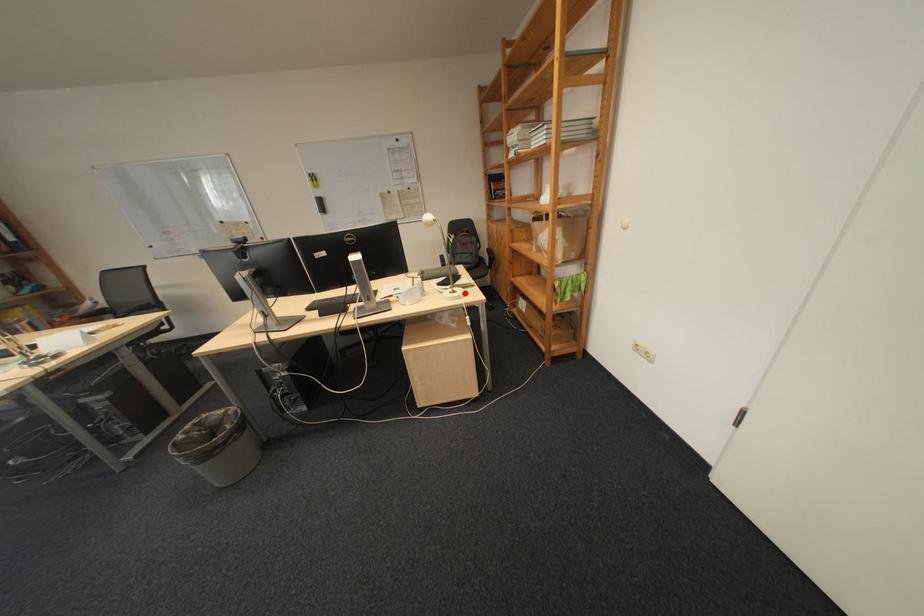
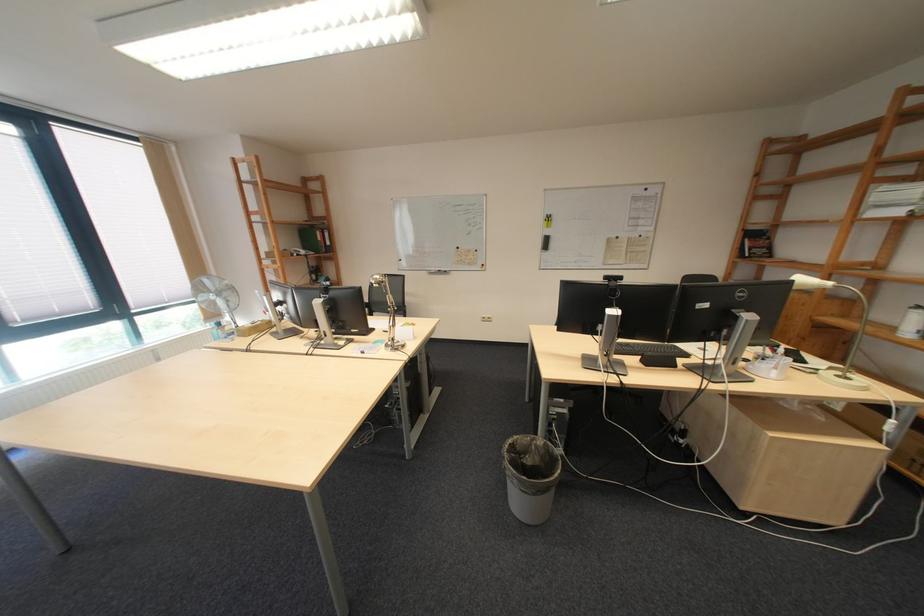
Where in the second image is the point corresponding to the highlighted location from the first image?

(853, 378)